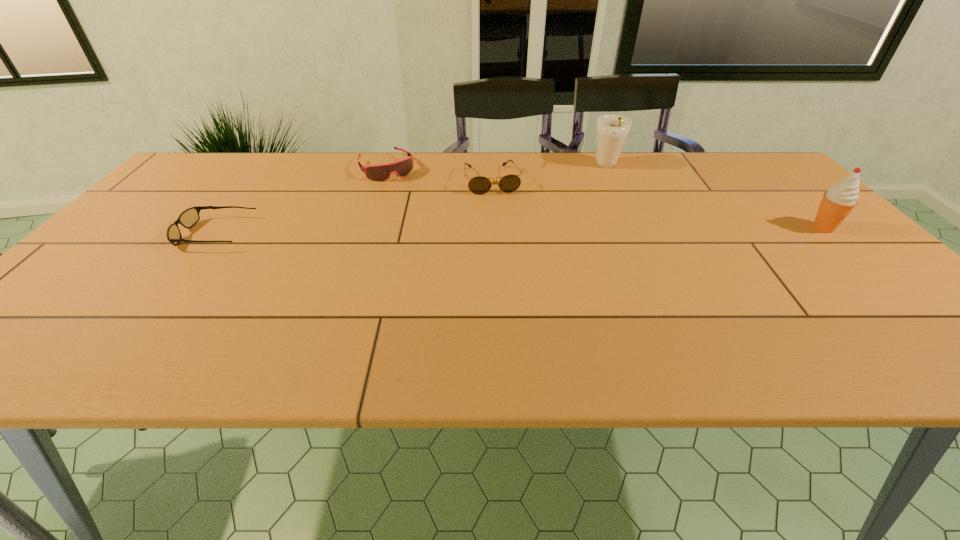
Locate an element on the screen. The width and height of the screenshot is (960, 540). the nearer sunglasses is located at coordinates (188, 218).

Locate an element on the screen. The width and height of the screenshot is (960, 540). the shortest object is located at coordinates (188, 218).

The width and height of the screenshot is (960, 540). Find the location of `the rightmost object`. the rightmost object is located at coordinates (838, 202).

What are the coordinates of `the taller sunglasses` in the screenshot? It's located at (479, 185).

The height and width of the screenshot is (540, 960). I want to click on the right sunglasses, so click(x=479, y=185).

Identify the location of root beer. (611, 132).

You are a GUI agent. You are given a task and a screenshot of the screen. Output one action in this format:
    pyautogui.click(x=<x>, y=<y>)
    Task: Click on the fourth object from right to left
    
    Given the screenshot: What is the action you would take?
    pyautogui.click(x=381, y=172)

At what (x,y) coordinates should I click in order to perform the action: click on free space located on the front-facing side of the shortest object. Please return your answer as a coordinate pair (x, y). Looking at the image, I should click on (136, 234).

Locate an element on the screen. This screenshot has width=960, height=540. vacant position located 0.070m on the front-facing side of the shortest object is located at coordinates (153, 234).

The image size is (960, 540). In order to click on vacant space located on the back of the icecream in this screenshot , I will do `click(777, 182)`.